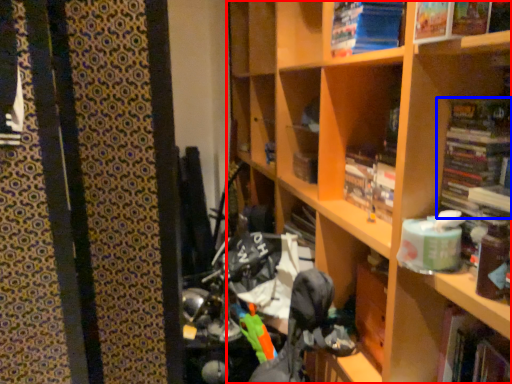
Question: Among these objects, which one is farthest to the camera, shelf (highlighted by a red box) or book (highlighted by a blue box)?

Choices:
 (A) shelf
 (B) book

Answer: (B)